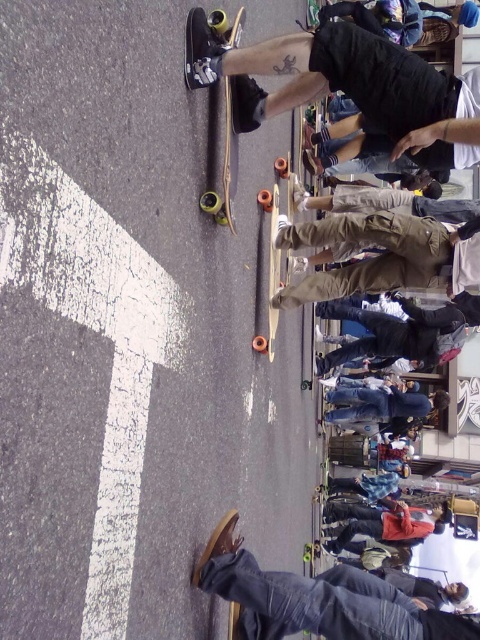
You are standing at the point labeled point (200, 45). If you want to move towards the point labeled point (269, 280), which direction should you face?

You should face backward because point (200, 45) is in front of point (269, 280), so moving towards it would require facing away from your current position.

You are a photographer trying to capture both the wooden skateboard at upper center and the wooden smooth skateboard at center in a single shot. Which skateboard should you focus on first to ensure both are in frame?

You should focus on the wooden skateboard at upper center first because it is closer to the viewer, allowing the wooden smooth skateboard at center to stay in frame as well.

You are a photographer standing at the scene, and you want to capture a closeup shot of the wooden skateboard at upper center. Given that your camera has a minimum focusing distance of 15 feet, will you be able to take the photo without moving closer?

The wooden skateboard at upper center is 20.17 feet away from the viewer. Since the camera can focus as close as 15 feet, you are currently 20.17 feet away, which is beyond the minimum focusing distance. Therefore, you can take the photo without moving closer.